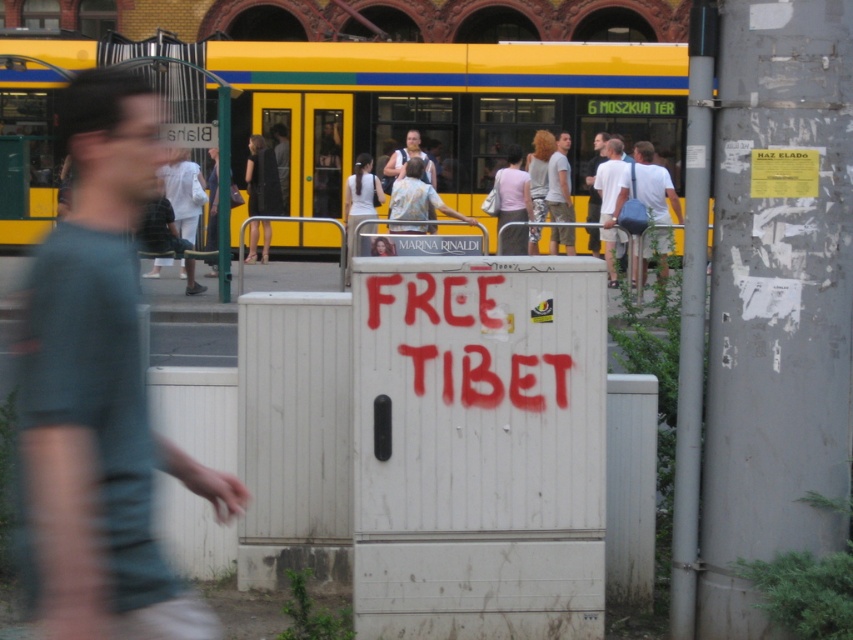
Which is in front, point (618, 163) or point (430, 232)?

Point (430, 232) is in front.

Locate an element on the screen. This screenshot has width=853, height=640. white cotton shirt at upper center is located at coordinates (608, 202).

Is point (660, 182) behind point (408, 148)?

No, (660, 182) is closer to viewer.

Measure the distance between white cotton shirt at center and camera.

The distance of white cotton shirt at center from camera is 27.69 feet.

Does point (663, 248) come in front of point (398, 170)?

That is True.

Find the location of a particular element. Image resolution: width=853 pixels, height=640 pixels. white cotton shirt at center is located at coordinates (648, 186).

Does yellow painted metal train at upper center appear on the right side of white cotton shirt at upper center?

In fact, yellow painted metal train at upper center is to the left of white cotton shirt at upper center.

At what (x,y) coordinates should I click in order to perform the action: click on yellow painted metal train at upper center. Please return your answer as a coordinate pair (x, y). Image resolution: width=853 pixels, height=640 pixels. Looking at the image, I should click on (445, 106).